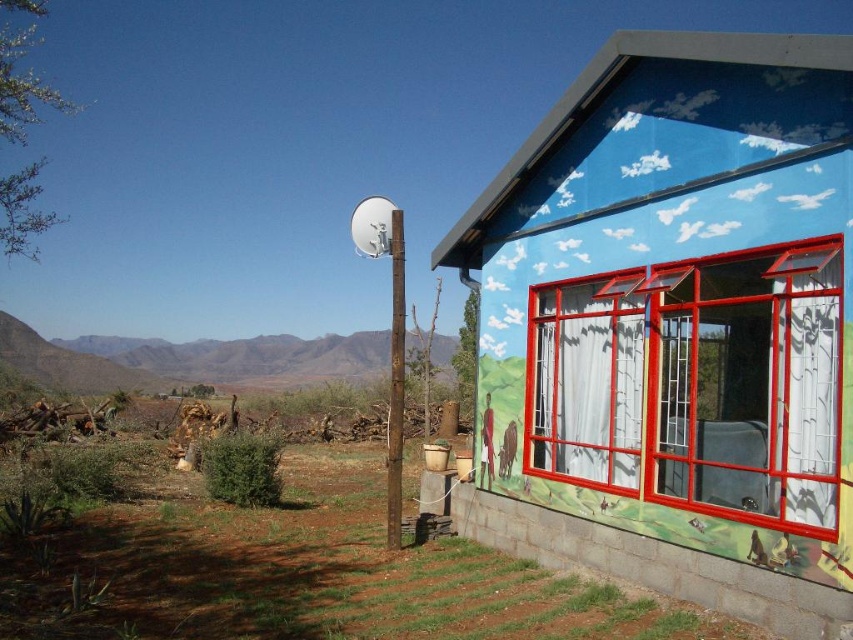
Does blue painted wall at upper right have a larger size compared to clear glass window at right?

Result: No, blue painted wall at upper right is not bigger than clear glass window at right.

Who is taller, blue painted wall at upper right or clear glass window at right?

With more height is clear glass window at right.

Does point (795, 538) lie behind point (576, 337)?

No, it is in front of (576, 337).

Find the location of `blue painted wall at upper right`. blue painted wall at upper right is located at coordinates (679, 320).